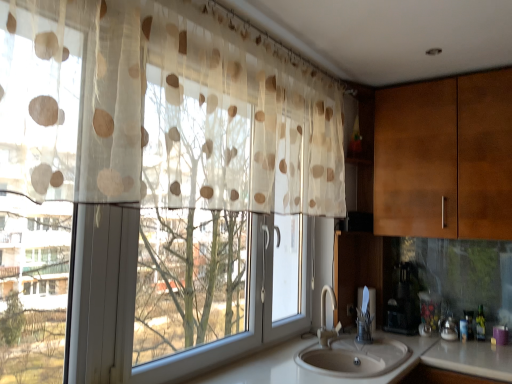
Question: From a real-world perspective, relative to wooden cabinet at right, is translucent plastic bottle at sink right vertically above or below?

Choices:
 (A) below
 (B) above

Answer: (A)

Question: Is point (479, 312) closer or farther from the camera than point (442, 233)?

Choices:
 (A) farther
 (B) closer

Answer: (A)

Question: Estimate the real-world distances between objects in this image. Which object is closer to the translucent beige polka dot curtain at left?

Choices:
 (A) translucent plastic bottle at sink right
 (B) black plastic coffee maker at lower right
 (C) wooden cabinet at right
 (D) white glossy counter top at lower center
 (E) white ceramic sink at lower center

Answer: (D)

Question: Which object is the farthest from the wooden cabinet at right?

Choices:
 (A) translucent beige polka dot curtain at left
 (B) white ceramic sink at lower center
 (C) translucent plastic bottle at sink right
 (D) black plastic coffee maker at lower right
 (E) white glossy counter top at lower center

Answer: (A)